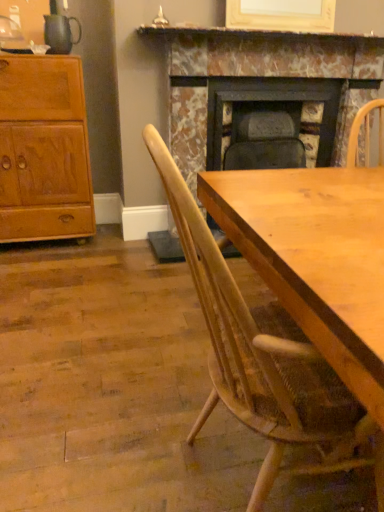
Question: Is light wood chair at center positioned behind marble fireplace at upper center?

Choices:
 (A) no
 (B) yes

Answer: (A)

Question: Does light wood chair at center have a greater height compared to marble fireplace at upper center?

Choices:
 (A) yes
 (B) no

Answer: (A)

Question: Is light wood chair at center looking in the opposite direction of marble fireplace at upper center?

Choices:
 (A) no
 (B) yes

Answer: (A)

Question: Does light wood chair at center contain marble fireplace at upper center?

Choices:
 (A) yes
 (B) no

Answer: (B)

Question: Are light wood chair at center and marble fireplace at upper center far apart?

Choices:
 (A) no
 (B) yes

Answer: (B)

Question: Is point (19, 233) positioned closer to the camera than point (269, 104)?

Choices:
 (A) farther
 (B) closer

Answer: (B)

Question: Is light brown wood cabinet at left bigger or smaller than marble fireplace at center?

Choices:
 (A) big
 (B) small

Answer: (B)

Question: Is light brown wood cabinet at left spatially inside marble fireplace at center, or outside of it?

Choices:
 (A) outside
 (B) inside

Answer: (A)

Question: In the image, is light brown wood cabinet at left positioned in front of or behind marble fireplace at center?

Choices:
 (A) behind
 (B) front

Answer: (B)

Question: Is marble fireplace at upper center spatially inside light wood chair at center, or outside of it?

Choices:
 (A) outside
 (B) inside

Answer: (A)

Question: From a real-world perspective, relative to light wood chair at center, is marble fireplace at upper center vertically above or below?

Choices:
 (A) below
 (B) above

Answer: (B)

Question: Considering their positions, is marble fireplace at upper center located in front of or behind light wood chair at center?

Choices:
 (A) behind
 (B) front

Answer: (A)

Question: Looking at their shapes, would you say marble fireplace at upper center is wider or thinner than light wood chair at center?

Choices:
 (A) thin
 (B) wide

Answer: (A)

Question: Considering the positions of point (271, 71) and point (213, 31), is point (271, 71) closer or farther from the camera than point (213, 31)?

Choices:
 (A) closer
 (B) farther

Answer: (B)

Question: From the image's perspective, is marble fireplace at center positioned above or below marble fireplace at upper center?

Choices:
 (A) below
 (B) above

Answer: (A)